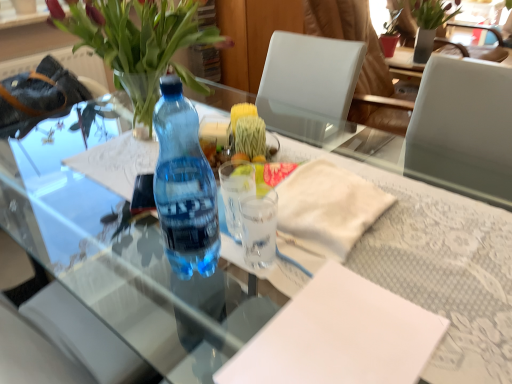
Find the location of a particular element. vacant space behind white paper at center, which is the 1th notepad from front to back is located at coordinates (355, 253).